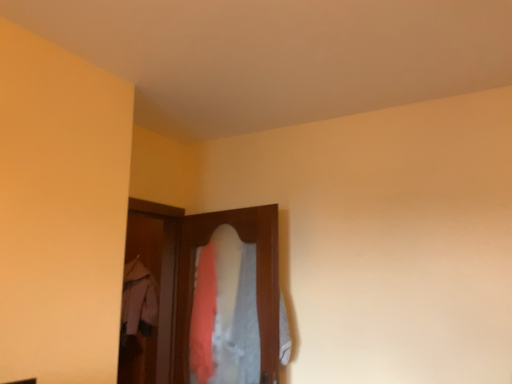
Question: Should I look upward or downward to see light pink fabric coat at center?

Choices:
 (A) down
 (B) up

Answer: (A)

Question: Is wooden screen door at center turned away from textured fabric closet at center?

Choices:
 (A) no
 (B) yes

Answer: (B)

Question: Is wooden screen door at center closer to camera compared to textured fabric closet at center?

Choices:
 (A) no
 (B) yes

Answer: (A)

Question: Is wooden screen door at center next to textured fabric closet at center?

Choices:
 (A) yes
 (B) no

Answer: (B)

Question: Could you tell me if wooden screen door at center is facing textured fabric closet at center?

Choices:
 (A) yes
 (B) no

Answer: (A)

Question: Considering the relative sizes of wooden screen door at center and textured fabric closet at center in the image provided, is wooden screen door at center wider than textured fabric closet at center?

Choices:
 (A) yes
 (B) no

Answer: (A)

Question: Does wooden screen door at center have a larger size compared to textured fabric closet at center?

Choices:
 (A) no
 (B) yes

Answer: (A)

Question: From a real-world perspective, is light pink fabric coat at center over textured fabric closet at center?

Choices:
 (A) no
 (B) yes

Answer: (A)

Question: Does light pink fabric coat at center come in front of textured fabric closet at center?

Choices:
 (A) yes
 (B) no

Answer: (B)

Question: Could you tell me if light pink fabric coat at center is facing textured fabric closet at center?

Choices:
 (A) no
 (B) yes

Answer: (A)

Question: From a real-world perspective, does light pink fabric coat at center sit lower than textured fabric closet at center?

Choices:
 (A) no
 (B) yes

Answer: (B)

Question: Is light pink fabric coat at center to the right of textured fabric closet at center from the viewer's perspective?

Choices:
 (A) no
 (B) yes

Answer: (A)

Question: Is light pink fabric coat at center at the left side of textured fabric closet at center?

Choices:
 (A) no
 (B) yes

Answer: (B)

Question: Does light pink fabric coat at center touch wooden screen door at center?

Choices:
 (A) yes
 (B) no

Answer: (A)